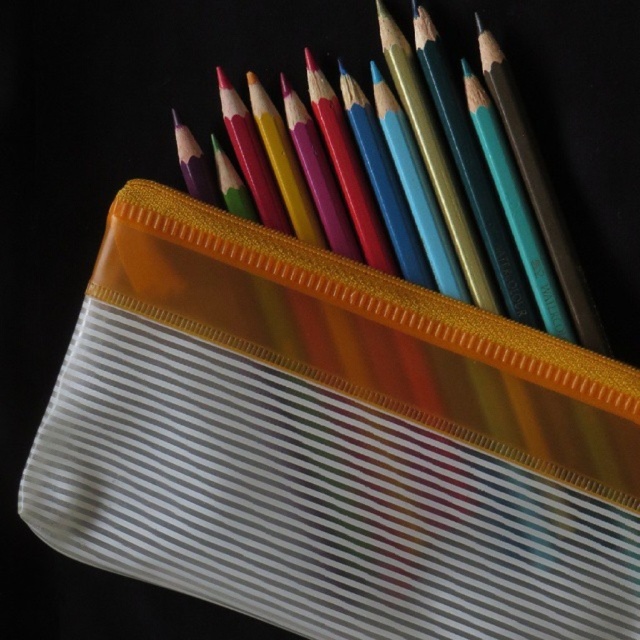
Is point (198, 472) farther from viewer compared to point (435, 35)?

Yes, it is behind point (435, 35).

Consider the image. Is the position of transparent plastic pencil case at upper center less distant than that of matte plastic pencil at upper center?

That is True.

Where is `transparent plastic pencil case at upper center`? The image size is (640, 640). transparent plastic pencil case at upper center is located at coordinates (332, 442).